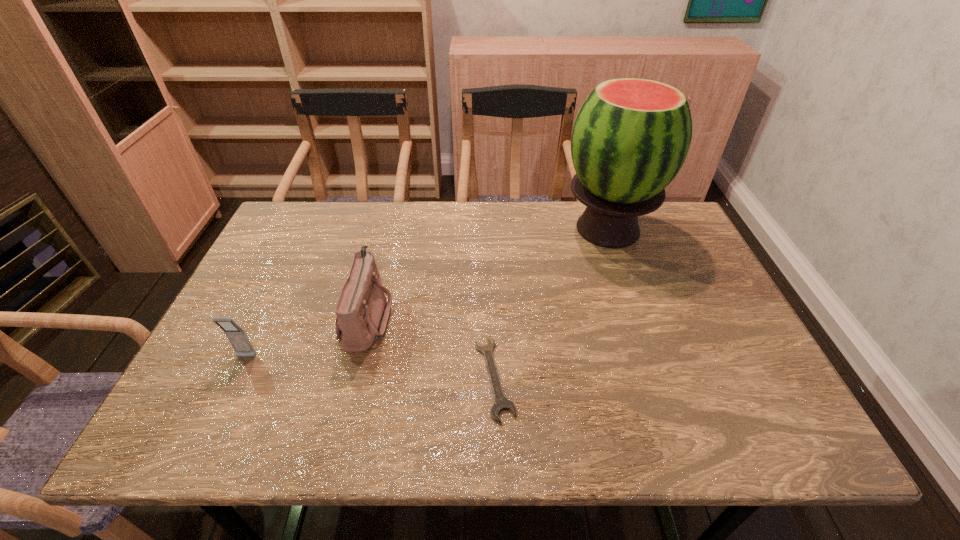
Find the location of a particular element. empty space that is in between the third object from right to left and the leftmost object is located at coordinates (306, 338).

The width and height of the screenshot is (960, 540). I want to click on vacant area between the shortest object and the cellular telephone, so click(371, 367).

Locate an element on the screen. the closest object to the shortest object is located at coordinates coord(362,312).

Point out which object is positioned as the nearest to the shoulder bag. Please provide its 2D coordinates. Your answer should be formatted as a tuple, i.e. [(x, y)], where the tuple contains the x and y coordinates of a point satisfying the conditions above.

[(237, 337)]

Where is `vacant space that satisfies the following two spatial constraints: 1. on the front-facing side of the second object from right to left; 2. on the right side of the leftmost object`? The height and width of the screenshot is (540, 960). vacant space that satisfies the following two spatial constraints: 1. on the front-facing side of the second object from right to left; 2. on the right side of the leftmost object is located at coordinates (237, 377).

You are a GUI agent. You are given a task and a screenshot of the screen. Output one action in this format:
    pyautogui.click(x=<x>, y=<y>)
    Task: Click on the free space that satisfies the following two spatial constraints: 1. on the front pocket of the second object from left to right; 2. on the right side of the third object from left to right
    
    Given the screenshot: What is the action you would take?
    pyautogui.click(x=352, y=377)